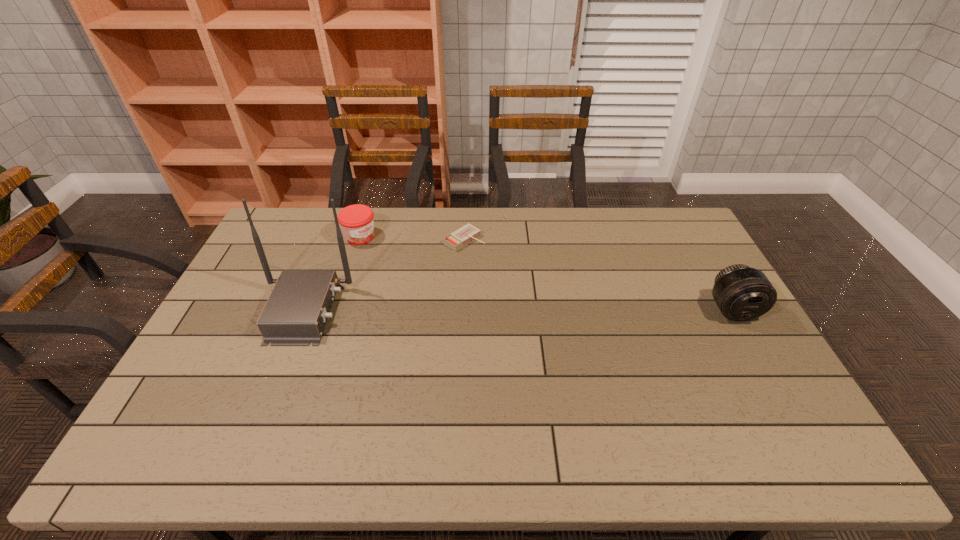
At what (x,y) coordinates should I click in order to perform the action: click on vacant space located on the label side of the second shortest object. Please return your answer as a coordinate pair (x, y). Looking at the image, I should click on (397, 262).

Identify the location of free space located on the striking surface of the matchbox. The image size is (960, 540). (542, 288).

Where is `vacant point located on the striking surface of the matchbox`? This screenshot has height=540, width=960. vacant point located on the striking surface of the matchbox is located at coordinates (x=526, y=278).

The height and width of the screenshot is (540, 960). Identify the location of free location located on the striking surface of the matchbox. (492, 256).

I want to click on jam that is at the far edge, so pos(357,223).

Image resolution: width=960 pixels, height=540 pixels. I want to click on matchbox located at the far edge, so [468, 233].

Locate an element on the screen. The height and width of the screenshot is (540, 960). object at the left edge is located at coordinates (295, 314).

Where is `object that is at the right edge`? The height and width of the screenshot is (540, 960). object that is at the right edge is located at coordinates (742, 293).

This screenshot has width=960, height=540. What are the coordinates of `free space at the far edge of the desktop` in the screenshot? It's located at (435, 214).

Where is `free region at the near edge`? free region at the near edge is located at coordinates (665, 403).